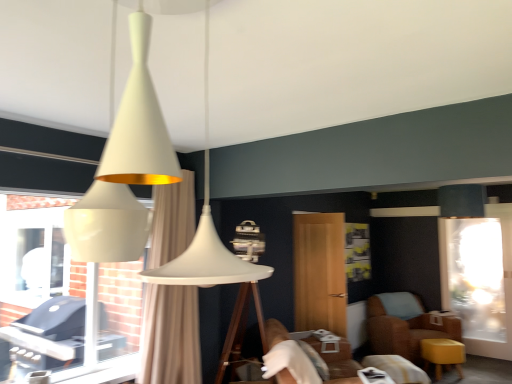
Question: In terms of size, does white glossy grill at left appear bigger or smaller than beige fabric curtain at center?

Choices:
 (A) big
 (B) small

Answer: (B)

Question: From the image's perspective, is white glossy grill at left located above or below beige fabric curtain at center?

Choices:
 (A) below
 (B) above

Answer: (B)

Question: Which of these objects is positioned farthest from the brown leather couch at lower center?

Choices:
 (A) transparent glass screen door at right, the 1th screen door in the right-to-left sequence
 (B) white glossy grill at left
 (C) wooden screen door at center, the 2th screen door from the back
 (D) satin black lampshade at upper right
 (E) beige fabric curtain at center

Answer: (B)

Question: Which object is the closest to the transparent glass screen door at right, placed as the 2th screen door when sorted from left to right?

Choices:
 (A) brown leather chair at lower right
 (B) brown leather couch at lower center
 (C) wooden screen door at center, the 2th screen door from the back
 (D) white glossy grill at left
 (E) satin black lampshade at upper right

Answer: (A)